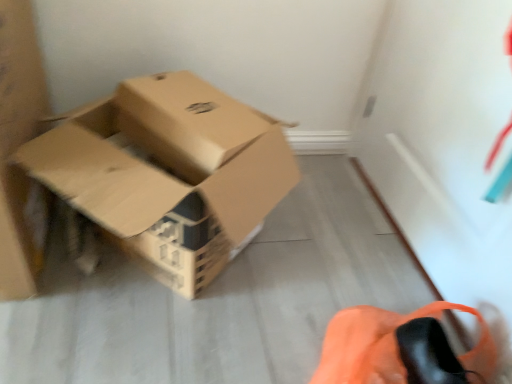
Where is `brown cardboard box at center`? The width and height of the screenshot is (512, 384). brown cardboard box at center is located at coordinates (169, 173).

Measure the distance between brown cardboard box at center and camera.

brown cardboard box at center and camera are 25.83 inches apart from each other.

This screenshot has width=512, height=384. What do you see at coordinates (169, 173) in the screenshot?
I see `brown cardboard box at center` at bounding box center [169, 173].

At what (x,y) coordinates should I click in order to perform the action: click on brown cardboard box at center. Please return your answer as a coordinate pair (x, y). Image resolution: width=512 pixels, height=384 pixels. Looking at the image, I should click on (169, 173).